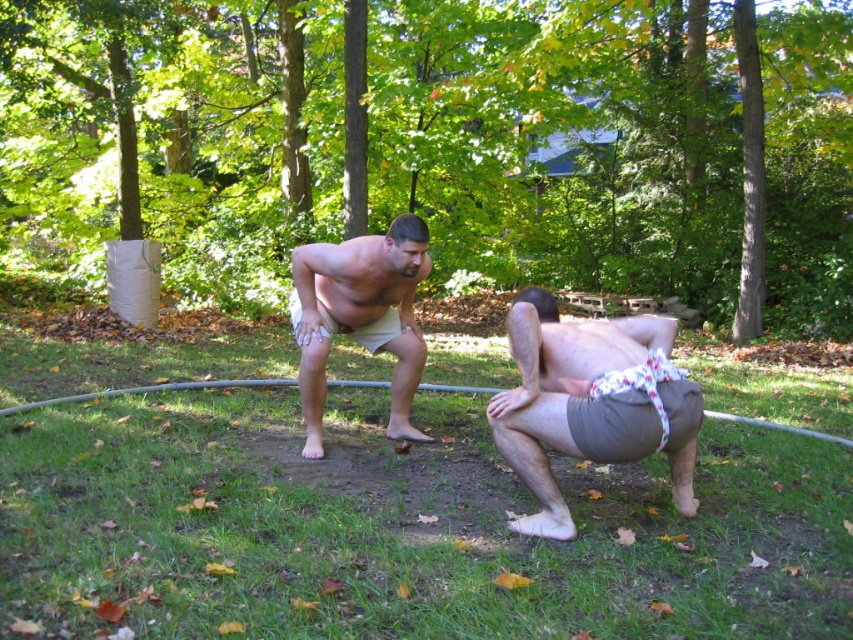
Question: Which point appears closest to the camera in this image?

Choices:
 (A) (320, 244)
 (B) (115, 624)
 (C) (561, 440)

Answer: (B)

Question: Can you confirm if green grass at center is positioned above brown cotton shorts at lower right?

Choices:
 (A) no
 (B) yes

Answer: (A)

Question: Is green grass at center positioned in front of beige cotton shorts at center?

Choices:
 (A) yes
 (B) no

Answer: (A)

Question: Estimate the real-world distances between objects in this image. Which object is closer to the beige cotton shorts at center?

Choices:
 (A) brown cotton shorts at lower right
 (B) green grass at center

Answer: (A)

Question: Which object is positioned closest to the green grass at center?

Choices:
 (A) brown cotton shorts at lower right
 (B) beige cotton shorts at center

Answer: (A)

Question: Does green grass at center appear on the left side of beige cotton shorts at center?

Choices:
 (A) yes
 (B) no

Answer: (B)